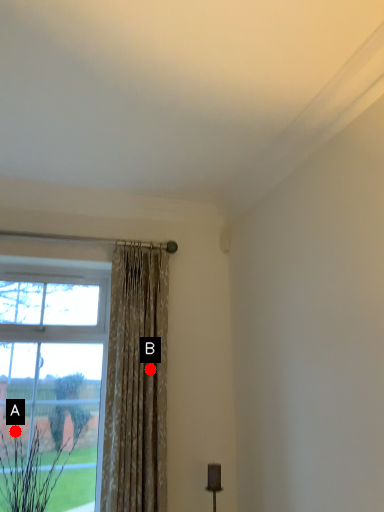
Question: Two points are circled on the image, labeled by A and B beside each circle. Which point is further to the camera?

Choices:
 (A) A is further
 (B) B is further

Answer: (B)